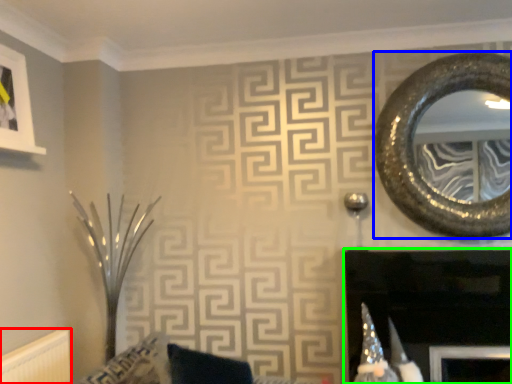
Question: Considering the real-world distances, which object is farthest from radiator (highlighted by a red box)? oval (highlighted by a blue box) or fireplace (highlighted by a green box)?

Choices:
 (A) oval
 (B) fireplace

Answer: (A)